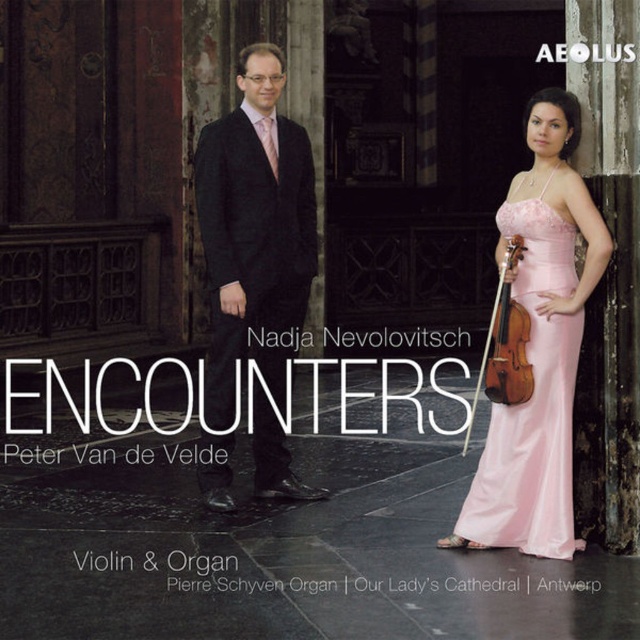
Question: Which of the following is the closest to the observer?

Choices:
 (A) pink satin dress at right
 (B) wooden violin at center
 (C) black wool suit at center

Answer: (A)

Question: Considering the real-world distances, which object is farthest from the black wool suit at center?

Choices:
 (A) pink satin dress at right
 (B) wooden violin at center

Answer: (B)

Question: Can you confirm if black wool suit at center is positioned above wooden violin at center?

Choices:
 (A) yes
 (B) no

Answer: (B)

Question: Among these objects, which one is farthest from the camera?

Choices:
 (A) black wool suit at center
 (B) pink satin dress at right
 (C) wooden violin at center

Answer: (A)

Question: In this image, where is black wool suit at center located relative to pink satin dress at right?

Choices:
 (A) above
 (B) below

Answer: (A)

Question: Is black wool suit at center positioned in front of pink satin dress at right?

Choices:
 (A) no
 (B) yes

Answer: (A)